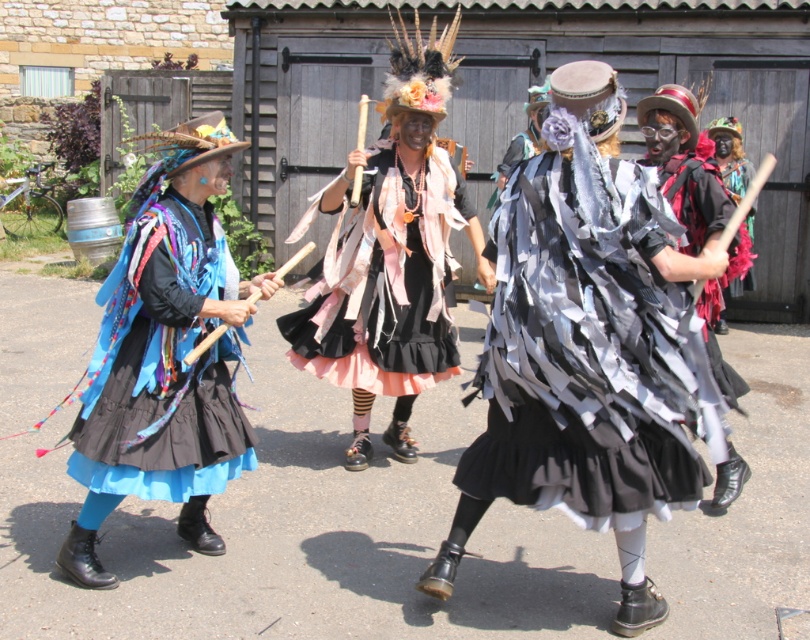
Does point (292, 326) come in front of point (188, 428)?

That is False.

Is the position of ruffled pink fabric skirt at center more distant than that of matte blue fabric skirt at left?

Yes, ruffled pink fabric skirt at center is behind matte blue fabric skirt at left.

Describe the element at coordinates (386, 284) in the screenshot. This screenshot has width=810, height=640. I see `ruffled pink fabric skirt at center` at that location.

Find the location of `ruffled pink fabric skirt at center`. ruffled pink fabric skirt at center is located at coordinates (386, 284).

Does shiny metallic ribbons at center appear under black feathered headdress at center?

Indeed, shiny metallic ribbons at center is positioned under black feathered headdress at center.

Between shiny metallic ribbons at center and black feathered headdress at center, which one appears on the right side from the viewer's perspective?

black feathered headdress at center is more to the right.

What do you see at coordinates (591, 349) in the screenshot?
I see `shiny metallic ribbons at center` at bounding box center [591, 349].

Locate an element on the screen. Image resolution: width=810 pixels, height=640 pixels. shiny metallic ribbons at center is located at coordinates (591, 349).

How distant is ruffled pink fabric skirt at center from black feathered headdress at center?

They are 4.58 meters apart.

In the scene shown: Who is taller, ruffled pink fabric skirt at center or black feathered headdress at center?

With more height is ruffled pink fabric skirt at center.

Find the location of `ruffled pink fabric skirt at center`. ruffled pink fabric skirt at center is located at coordinates (386, 284).